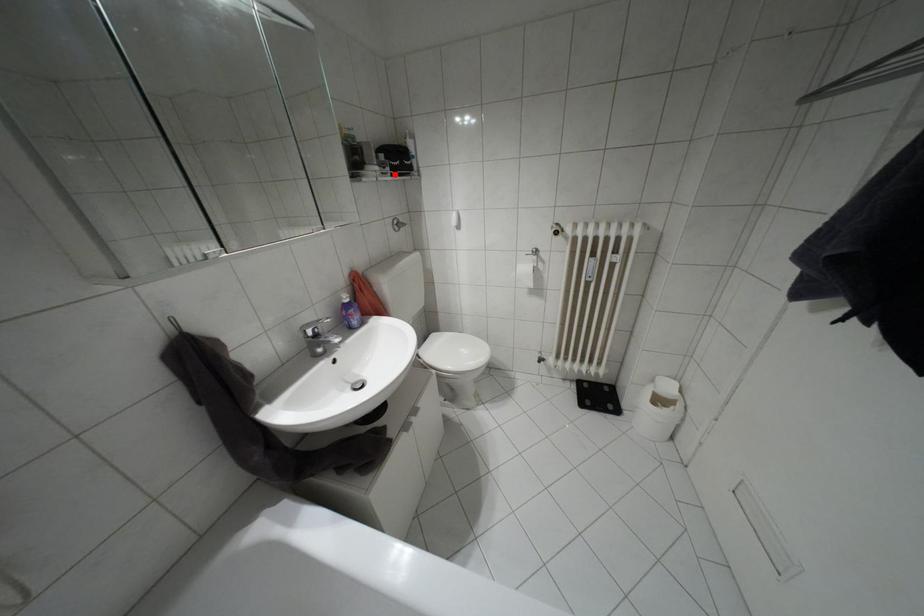
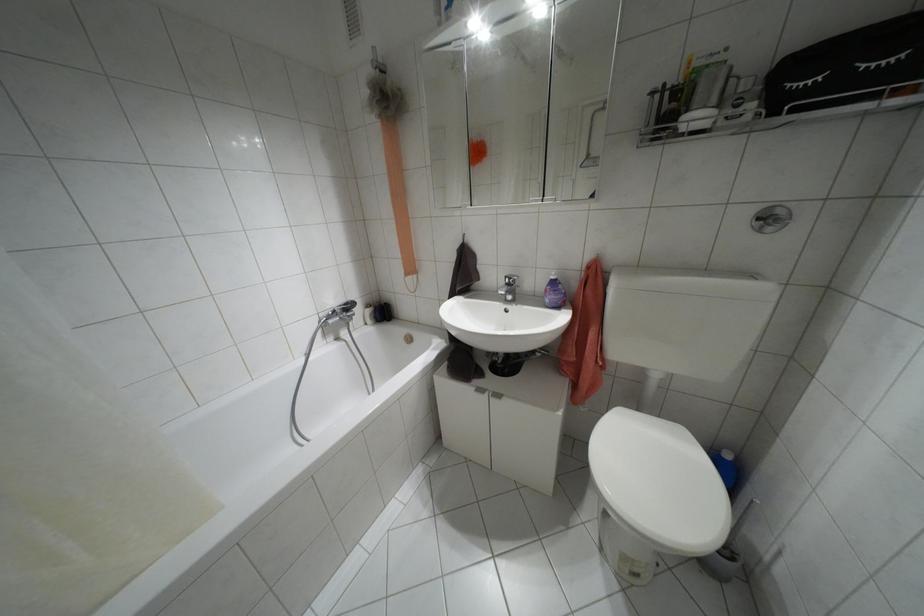
Find the pixel in the second image that matches the highlighted location in the first image.

(773, 113)